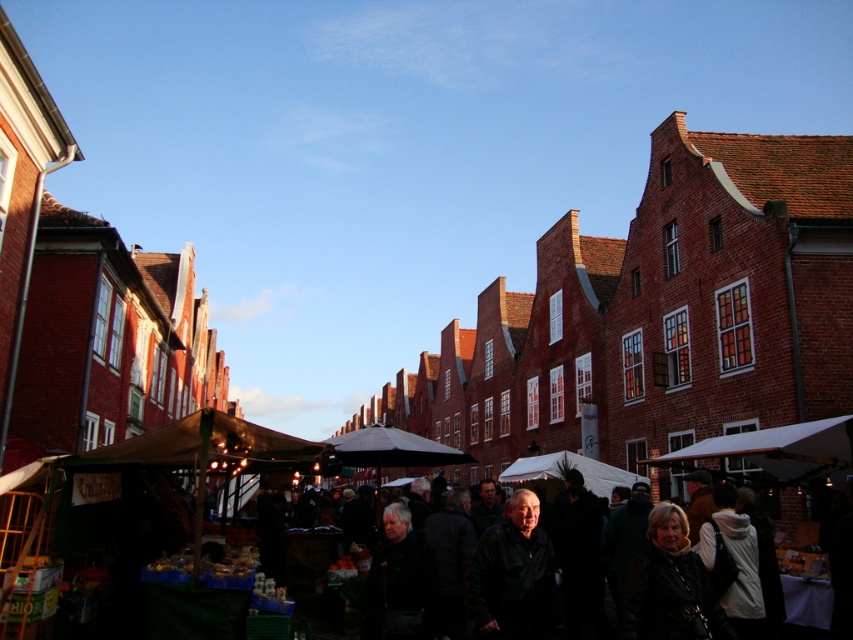
You are a customer at the market and want to choose between the black leather jacket at center and the dark brown leather jacket at lower right. Which jacket is thinner?

The black leather jacket at center is thinner than the dark brown leather jacket at lower right.

You are standing at the entrance of the market and want to find the green fabric market stall at center. According to the coordinates provided, what are the exact coordinates where you should look to locate it?

The green fabric market stall at center is located at coordinates point (233, 449).

You are standing in the market and want to take a photo of both the point at coordinates (x=708, y=452) and the point at coordinates (x=477, y=586). Which point should you focus on first to ensure both are in focus?

You should focus on the point at coordinates (x=477, y=586) first because it is closer to you than the point at coordinates (x=708, y=452), which is further away. By focusing on the closer point, the further one will also be in focus due to depth of field.